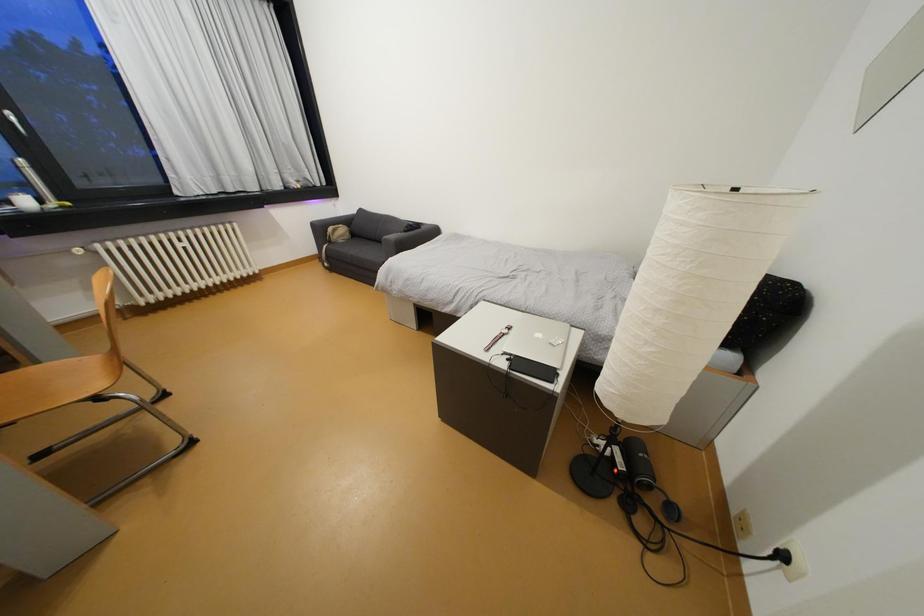
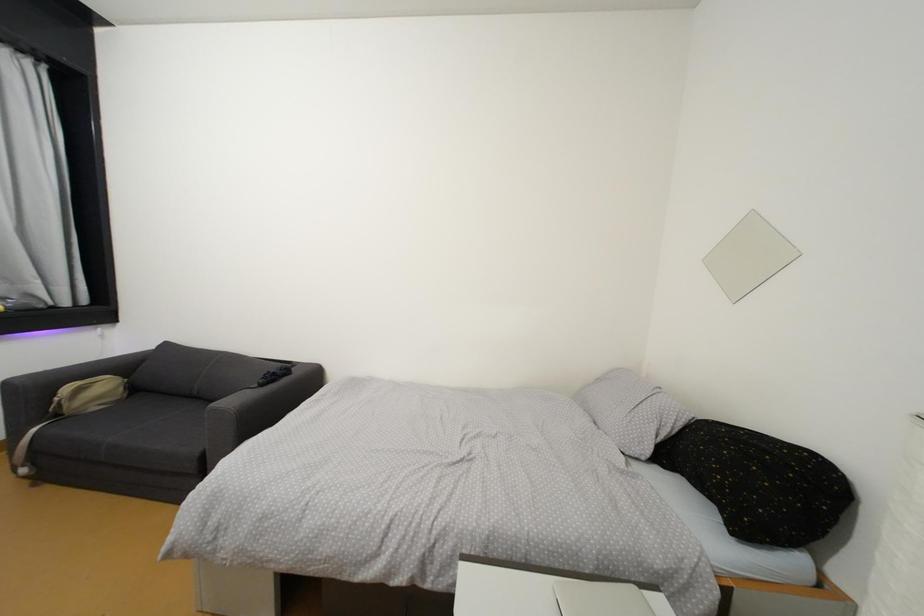
Consider the image. The images are taken continuously from a first-person perspective. In which direction is your viewpoint rotating?

The camera's rotation is toward right-up.